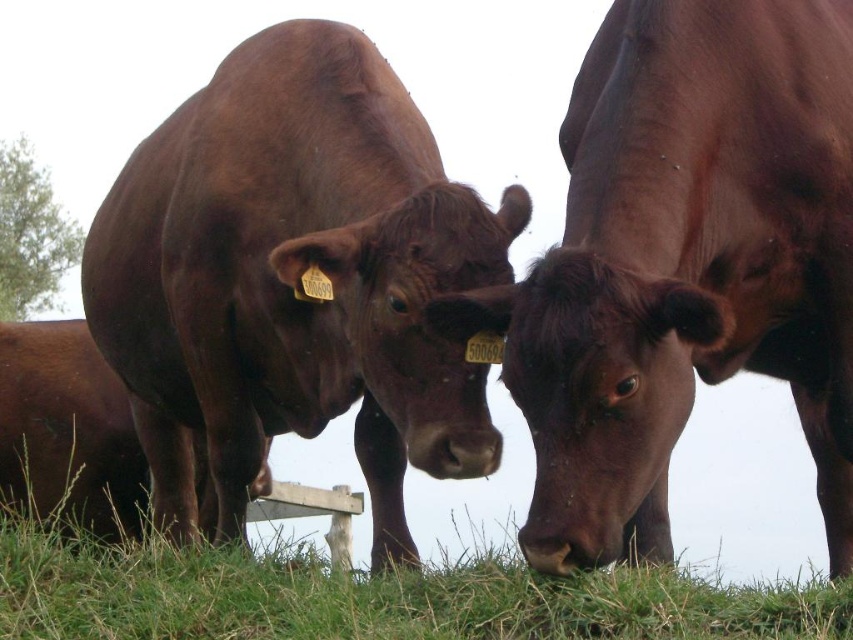
Question: Can you confirm if shiny brown bull at center is positioned above green grass at lower center?

Choices:
 (A) yes
 (B) no

Answer: (A)

Question: Among these objects, which one is farthest from the camera?

Choices:
 (A) shiny brown cow at center
 (B) brown matte cow at center
 (C) shiny brown bull at center
 (D) green grass at lower center

Answer: (B)

Question: Which point is farther from the camera taking this photo?

Choices:
 (A) (509, 620)
 (B) (614, 412)
 (C) (91, 268)

Answer: (C)

Question: Among these objects, which one is farthest from the camera?

Choices:
 (A) shiny brown cow at center
 (B) green grass at lower center
 (C) shiny brown bull at center

Answer: (C)

Question: Is shiny brown cow at center in front of brown matte cow at center?

Choices:
 (A) no
 (B) yes

Answer: (B)

Question: Can you confirm if shiny brown cow at center is positioned below shiny brown bull at center?

Choices:
 (A) yes
 (B) no

Answer: (A)